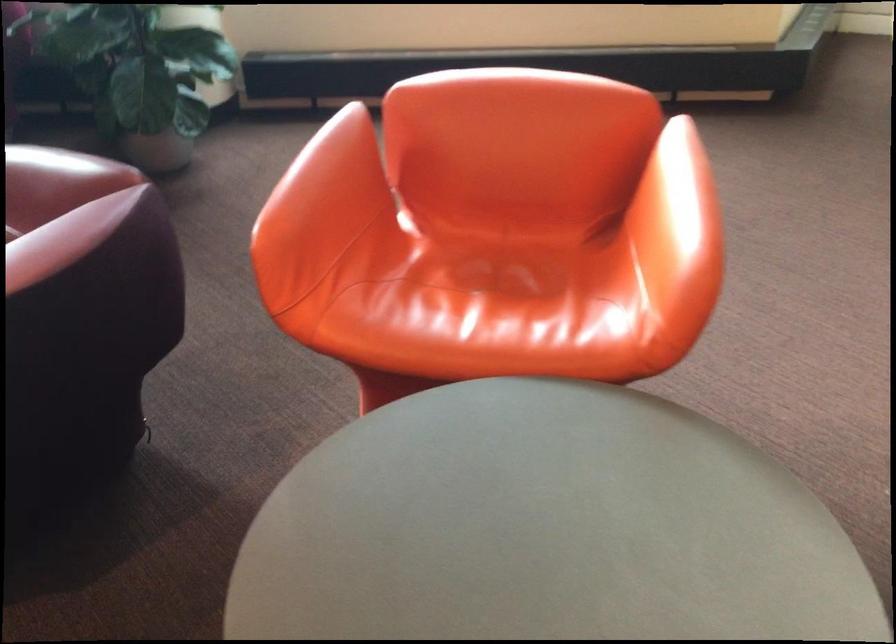
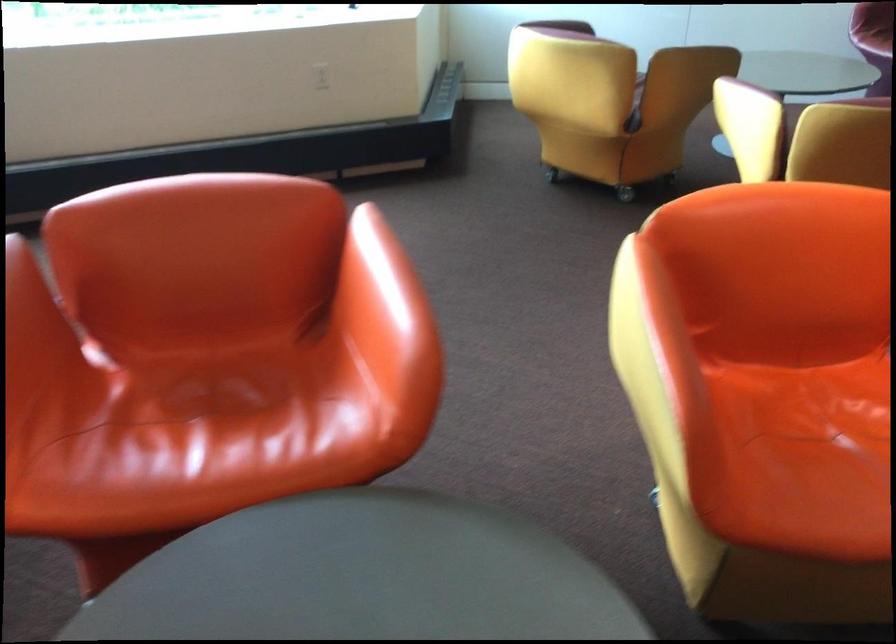
Find the pixel in the second image that matches (490,261) in the first image.

(208, 384)